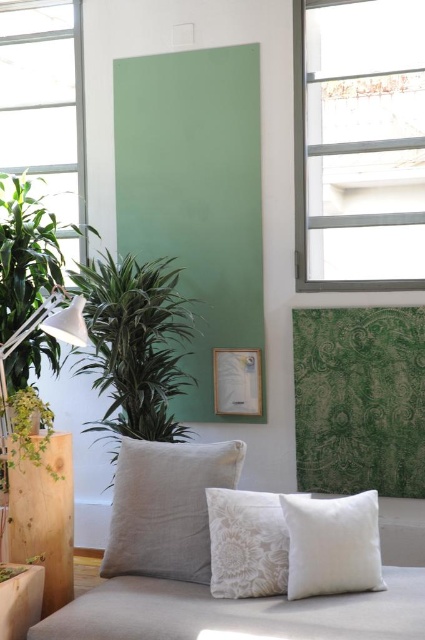
In order to click on clear glass window at upper right in this screenshot , I will do click(359, 144).

Does point (328, 276) come in front of point (207, 492)?

That is False.

Find the location of `clear glass window at upper right`. clear glass window at upper right is located at coordinates (359, 144).

Identify the location of white textured pillow at center. The height and width of the screenshot is (640, 425). (166, 508).

From the picture: Can you confirm if white textured pillow at center is wider than white fabric pillow at lower right?

Yes.

Describe the element at coordinates (166, 508) in the screenshot. The height and width of the screenshot is (640, 425). I see `white textured pillow at center` at that location.

You are a GUI agent. You are given a task and a screenshot of the screen. Output one action in this format:
    pyautogui.click(x=<x>, y=<y>)
    Task: Click on the white textured pillow at center
    Image resolution: width=425 pixels, height=640 pixels.
    Given the screenshot: What is the action you would take?
    pyautogui.click(x=166, y=508)

Is transparent glass window at upper left thinner than white textured pillow at center?

Incorrect, transparent glass window at upper left's width is not less than white textured pillow at center's.

Looking at this image, is transparent glass window at upper left above white textured pillow at center?

Yes.

Does point (62, 104) come behind point (113, 573)?

That is True.

Find the location of a particular element. The width and height of the screenshot is (425, 640). transparent glass window at upper left is located at coordinates (45, 106).